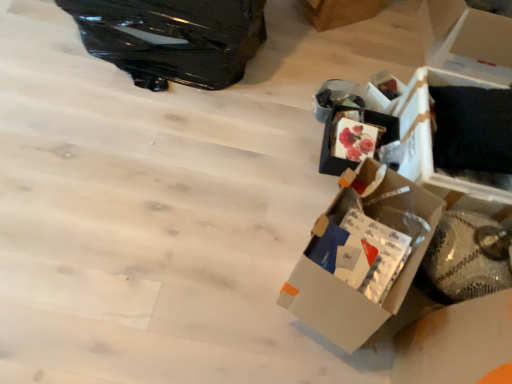
Question: Does black cardboard box at right, placed as the 1th storage box when sorted from front to back, have a lesser width compared to white cardboard box at upper right, arranged as the second storage box when viewed from the front?

Choices:
 (A) yes
 (B) no

Answer: (B)

Question: Are black cardboard box at right, arranged as the 2th storage box when viewed from the back, and white cardboard box at upper right, arranged as the 1th storage box when viewed from the back, beside each other?

Choices:
 (A) no
 (B) yes

Answer: (A)

Question: Does black cardboard box at right, arranged as the 2th storage box when viewed from the back, have a greater width compared to white cardboard box at upper right, arranged as the second storage box when viewed from the front?

Choices:
 (A) no
 (B) yes

Answer: (B)

Question: Considering the relative sizes of black cardboard box at right, arranged as the 2th storage box when viewed from the back, and white cardboard box at upper right, arranged as the 1th storage box when viewed from the back, in the image provided, is black cardboard box at right, arranged as the 2th storage box when viewed from the back, shorter than white cardboard box at upper right, arranged as the 1th storage box when viewed from the back,?

Choices:
 (A) yes
 (B) no

Answer: (B)

Question: Can you confirm if black cardboard box at right, placed as the 1th storage box when sorted from front to back, is positioned to the right of white cardboard box at upper right, arranged as the second storage box when viewed from the front?

Choices:
 (A) yes
 (B) no

Answer: (A)

Question: Is glossy black suitcase at upper left wider or thinner than white cardboard box at upper right, placed as the second cardboard box when sorted from right to left?

Choices:
 (A) thin
 (B) wide

Answer: (B)

Question: From the image's perspective, is glossy black suitcase at upper left located above or below white cardboard box at upper right, which is the first cardboard box from left to right?

Choices:
 (A) above
 (B) below

Answer: (B)

Question: Is glossy black suitcase at upper left taller or shorter than white cardboard box at upper right, which is the first cardboard box from left to right?

Choices:
 (A) short
 (B) tall

Answer: (B)

Question: Is glossy black suitcase at upper left inside the boundaries of white cardboard box at upper right, placed as the second cardboard box when sorted from right to left, or outside?

Choices:
 (A) inside
 (B) outside

Answer: (B)

Question: In the image, is white cardboard box at upper right, the first cardboard box when ordered from right to left, positioned in front of or behind glossy black suitcase at upper left?

Choices:
 (A) front
 (B) behind

Answer: (B)

Question: From the image's perspective, is white cardboard box at upper right, the first cardboard box when ordered from right to left, positioned above or below glossy black suitcase at upper left?

Choices:
 (A) below
 (B) above

Answer: (A)

Question: From a real-world perspective, is white cardboard box at upper right, the first cardboard box when ordered from right to left, positioned above or below glossy black suitcase at upper left?

Choices:
 (A) above
 (B) below

Answer: (B)

Question: Would you say white cardboard box at upper right, the first cardboard box when ordered from right to left, is to the left or to the right of glossy black suitcase at upper left in the picture?

Choices:
 (A) right
 (B) left

Answer: (A)

Question: Is glossy black suitcase at upper left to the left or to the right of black cardboard box at right, placed as the 1th storage box when sorted from front to back, in the image?

Choices:
 (A) right
 (B) left

Answer: (B)

Question: Is glossy black suitcase at upper left taller or shorter than black cardboard box at right, arranged as the 2th storage box when viewed from the back?

Choices:
 (A) tall
 (B) short

Answer: (A)